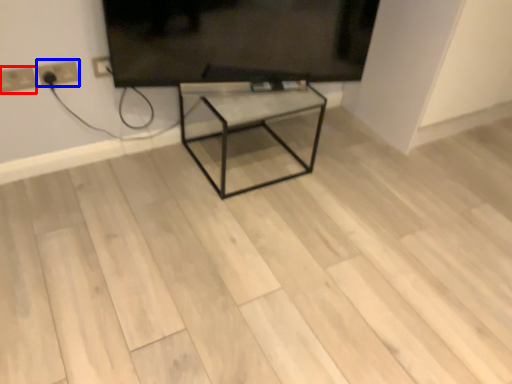
Question: Which object is further to the camera taking this photo, electric outlet (highlighted by a red box) or electric outlet (highlighted by a blue box)?

Choices:
 (A) electric outlet
 (B) electric outlet

Answer: (B)